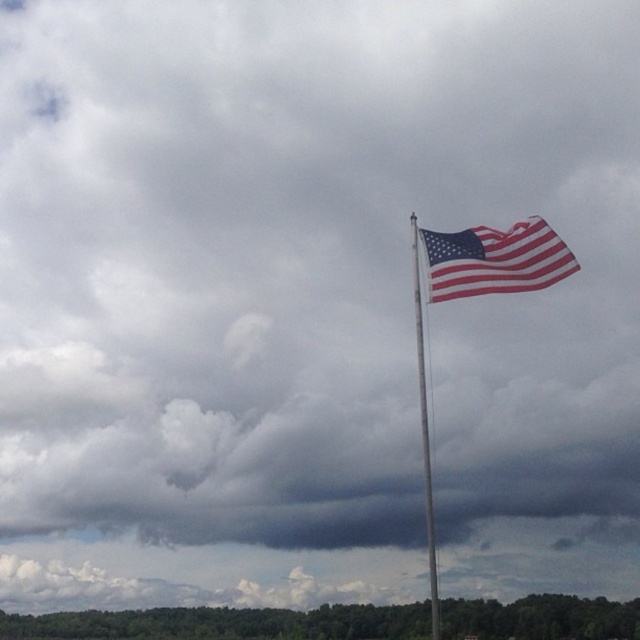
Between point (449, 284) and point (426, 486), which one is positioned in front?

Positioned in front is point (449, 284).

Describe the element at coordinates (496, 259) in the screenshot. Image resolution: width=640 pixels, height=640 pixels. I see `red-white striped fabric flag at upper right` at that location.

Locate an element on the screen. The height and width of the screenshot is (640, 640). red-white striped fabric flag at upper right is located at coordinates (496, 259).